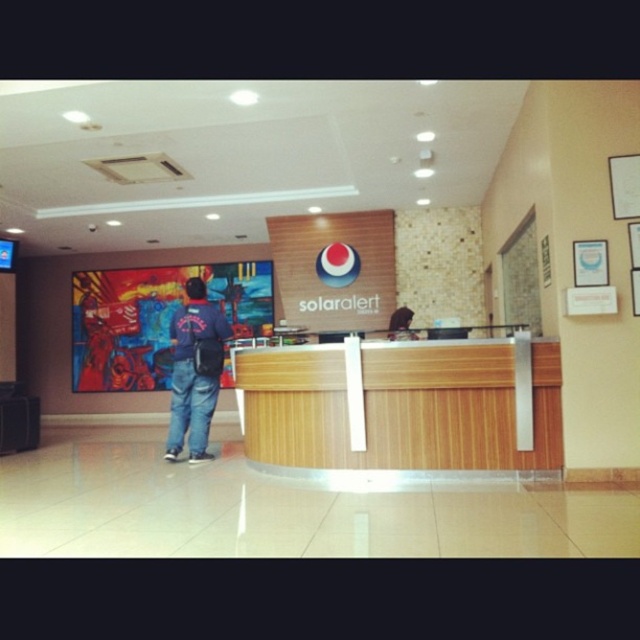
You are a visitor approaching the wooden reception desk at center and the denim jacket at center in the lobby. Which object will you encounter first as you move towards them?

You will encounter the wooden reception desk at center first because it is closer to you than the denim jacket at center.